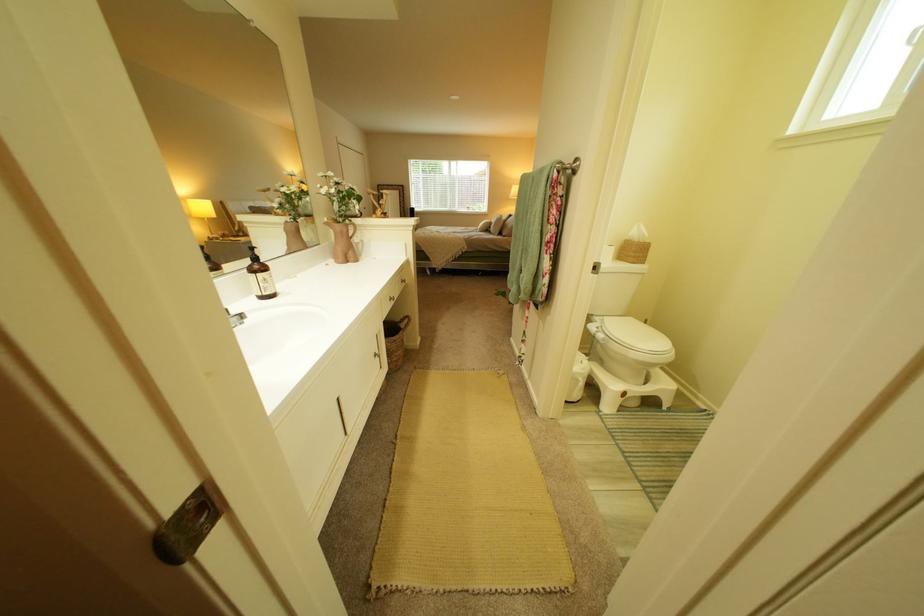
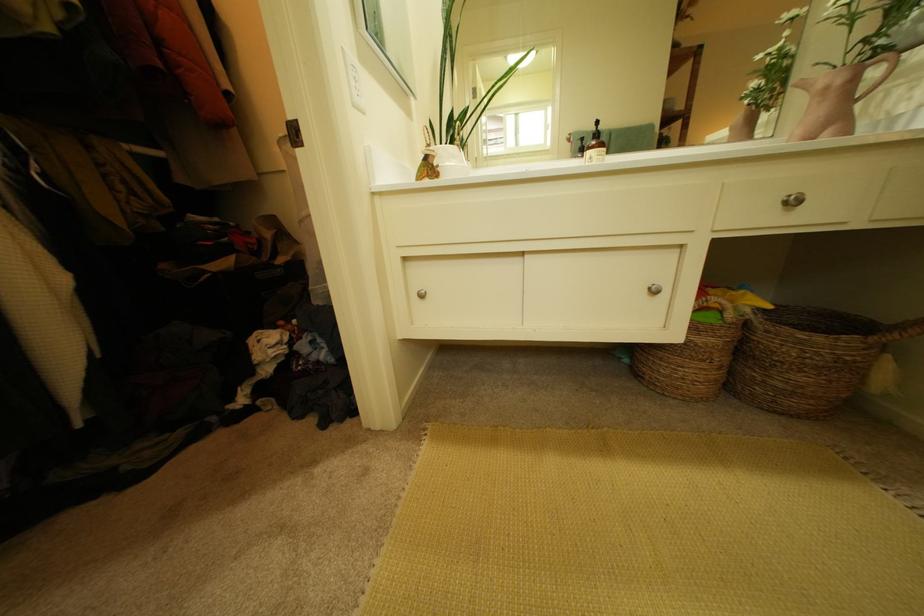
The images are taken continuously from a first-person perspective. In which direction is your viewpoint rotating?

The rotation direction of the camera is left-down.